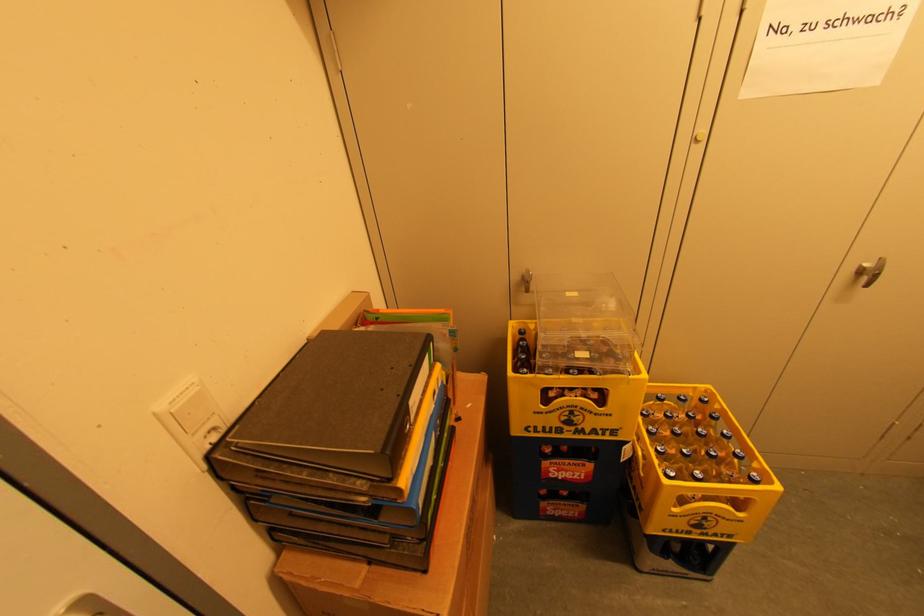
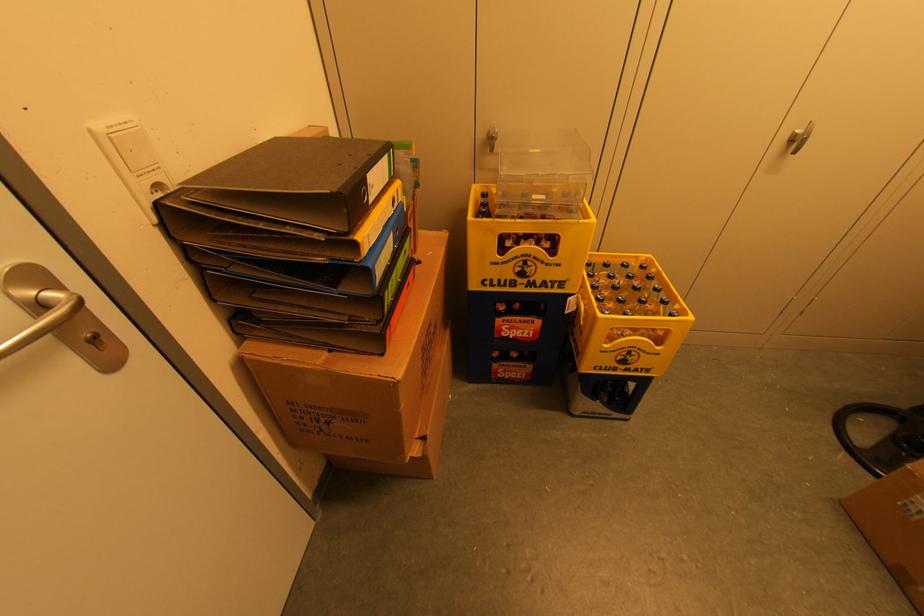
Locate, in the second image, the point that corresponds to [527,290] in the first image.

(491, 150)